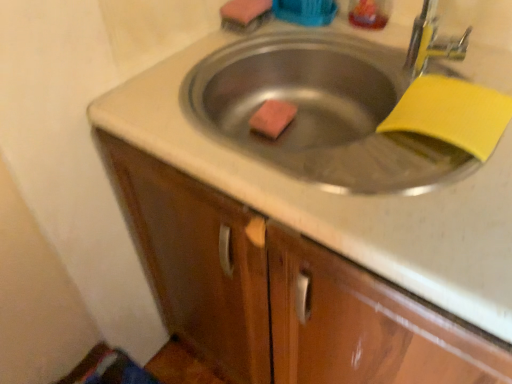
Question: Does pink sponge at center, which appears as the second soap when viewed from the top, appear on the right side of translucent plastic liquid at upper right?

Choices:
 (A) no
 (B) yes

Answer: (A)

Question: From a real-world perspective, is pink sponge at center, arranged as the 1th soap when ordered from the bottom, on translucent plastic liquid at upper right?

Choices:
 (A) yes
 (B) no

Answer: (B)

Question: From a real-world perspective, is pink sponge at center, which appears as the second soap when viewed from the top, below translucent plastic liquid at upper right?

Choices:
 (A) yes
 (B) no

Answer: (A)

Question: Is pink sponge at center, arranged as the 1th soap when ordered from the bottom, oriented away from translucent plastic liquid at upper right?

Choices:
 (A) no
 (B) yes

Answer: (A)

Question: Is pink sponge at center, arranged as the 1th soap when ordered from the bottom, placed right next to translucent plastic liquid at upper right?

Choices:
 (A) no
 (B) yes

Answer: (A)

Question: Considering the positions of pink sponge at center, which appears as the second soap when viewed from the top, and wooden cabinet at center in the image, is pink sponge at center, which appears as the second soap when viewed from the top, bigger or smaller than wooden cabinet at center?

Choices:
 (A) small
 (B) big

Answer: (A)

Question: From the image's perspective, is pink sponge at center, arranged as the 1th soap when ordered from the bottom, above or below wooden cabinet at center?

Choices:
 (A) below
 (B) above

Answer: (B)

Question: Is point (257, 127) closer or farther from the camera than point (147, 160)?

Choices:
 (A) closer
 (B) farther

Answer: (B)

Question: Based on their positions, is pink sponge at center, arranged as the 1th soap when ordered from the bottom, located to the left or right of wooden cabinet at center?

Choices:
 (A) right
 (B) left

Answer: (B)

Question: Is translucent plastic liquid at upper right wider or thinner than wooden cabinet at center?

Choices:
 (A) thin
 (B) wide

Answer: (A)

Question: In the image, is translucent plastic liquid at upper right positioned in front of or behind wooden cabinet at center?

Choices:
 (A) front
 (B) behind

Answer: (B)

Question: From a real-world perspective, is translucent plastic liquid at upper right above or below wooden cabinet at center?

Choices:
 (A) above
 (B) below

Answer: (A)

Question: Considering the positions of point (371, 1) and point (309, 372), is point (371, 1) closer or farther from the camera than point (309, 372)?

Choices:
 (A) farther
 (B) closer

Answer: (A)

Question: Visually, is wooden cabinet at center positioned to the left or to the right of translucent plastic liquid at upper right?

Choices:
 (A) right
 (B) left

Answer: (B)

Question: Which is correct: wooden cabinet at center is inside translucent plastic liquid at upper right, or outside of it?

Choices:
 (A) inside
 (B) outside

Answer: (B)